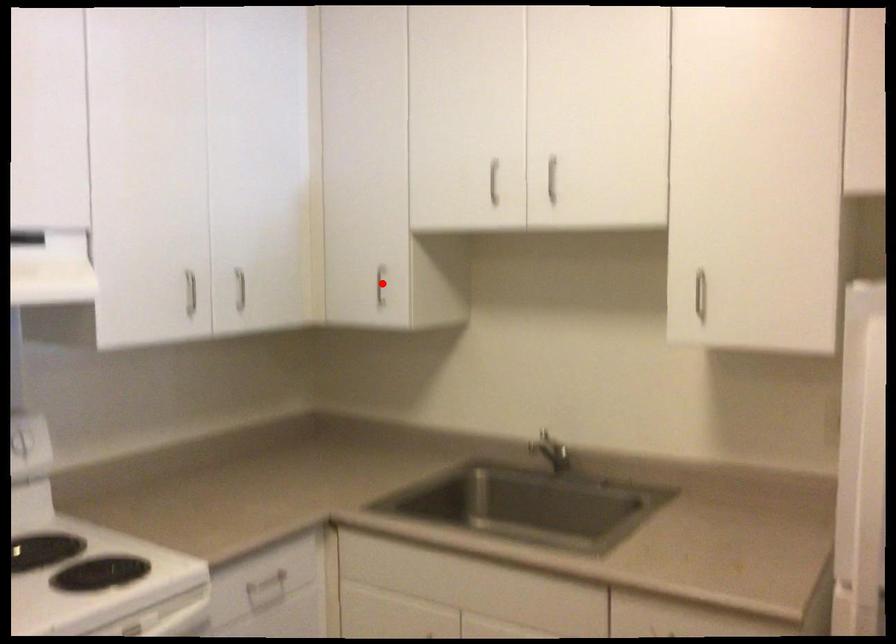
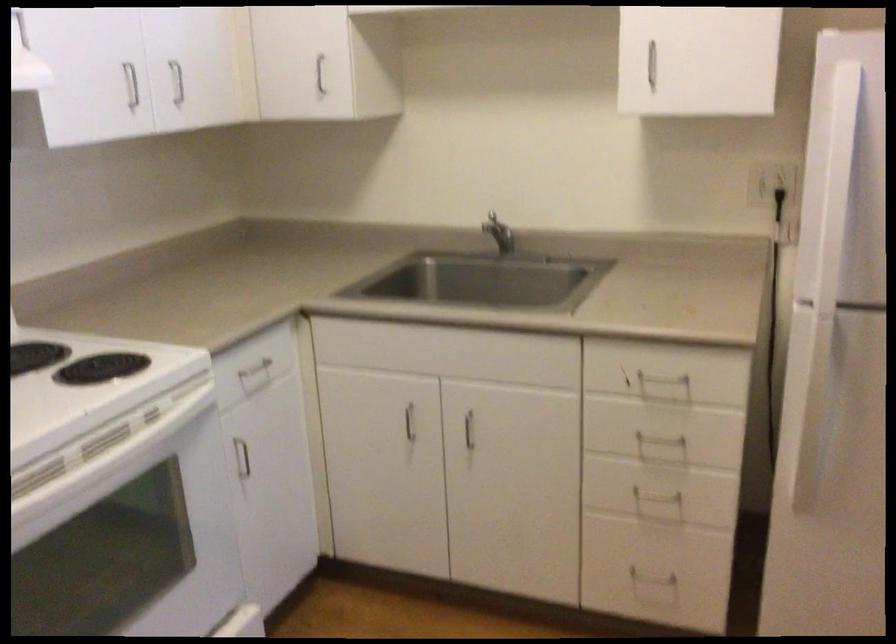
The point at the highlighted location is marked in the first image. Where is the corresponding point in the second image?

(319, 75)